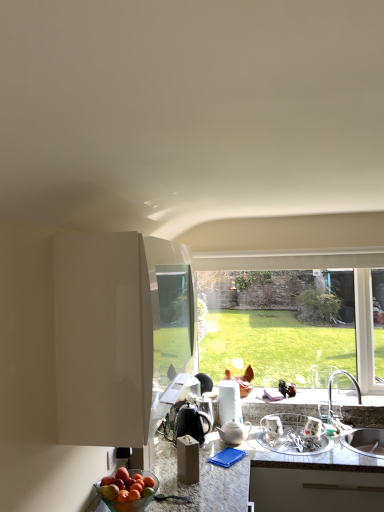
Question: Considering the relative positions of granite countertop at center and metallic silver dish rack at lower right, marked as the third appliance in a left-to-right arrangement, in the image provided, is granite countertop at center behind metallic silver dish rack at lower right, marked as the third appliance in a left-to-right arrangement,?

Choices:
 (A) yes
 (B) no

Answer: (B)

Question: Is granite countertop at center far away from metallic silver dish rack at lower right, marked as the third appliance in a left-to-right arrangement?

Choices:
 (A) yes
 (B) no

Answer: (B)

Question: Is the surface of granite countertop at center in direct contact with metallic silver dish rack at lower right, marked as the third appliance in a left-to-right arrangement?

Choices:
 (A) no
 (B) yes

Answer: (A)

Question: Considering the relative sizes of granite countertop at center and metallic silver dish rack at lower right, the 1th appliance viewed from the right, in the image provided, is granite countertop at center bigger than metallic silver dish rack at lower right, the 1th appliance viewed from the right,?

Choices:
 (A) no
 (B) yes

Answer: (B)

Question: Is granite countertop at center to the left of metallic silver dish rack at lower right, marked as the third appliance in a left-to-right arrangement, from the viewer's perspective?

Choices:
 (A) yes
 (B) no

Answer: (A)

Question: From the image's perspective, is shiny metallic kettle at center, marked as the 3th appliance in a right-to-left arrangement, positioned above or below white glossy cabinet at left?

Choices:
 (A) above
 (B) below

Answer: (B)

Question: Which is correct: shiny metallic kettle at center, acting as the first appliance starting from the left, is inside white glossy cabinet at left, or outside of it?

Choices:
 (A) outside
 (B) inside

Answer: (A)

Question: Is shiny metallic kettle at center, marked as the 3th appliance in a right-to-left arrangement, wider or thinner than white glossy cabinet at left?

Choices:
 (A) wide
 (B) thin

Answer: (B)

Question: Considering their positions, is shiny metallic kettle at center, acting as the first appliance starting from the left, located in front of or behind white glossy cabinet at left?

Choices:
 (A) behind
 (B) front

Answer: (A)

Question: From a real-world perspective, is metallic silver kettle at center, the second appliance from the right, positioned above or below granite countertop at center?

Choices:
 (A) above
 (B) below

Answer: (A)

Question: Based on their sizes in the image, would you say metallic silver kettle at center, acting as the 2th appliance starting from the left, is bigger or smaller than granite countertop at center?

Choices:
 (A) big
 (B) small

Answer: (B)

Question: In terms of height, does metallic silver kettle at center, the second appliance from the right, look taller or shorter compared to granite countertop at center?

Choices:
 (A) short
 (B) tall

Answer: (A)

Question: Visually, is metallic silver kettle at center, the second appliance from the right, positioned to the left or to the right of granite countertop at center?

Choices:
 (A) left
 (B) right

Answer: (A)

Question: Based on their sizes in the image, would you say white glossy cabinet at left is bigger or smaller than metallic silver dish rack at lower right, the 1th appliance viewed from the right?

Choices:
 (A) big
 (B) small

Answer: (A)

Question: Which is correct: white glossy cabinet at left is inside metallic silver dish rack at lower right, the 1th appliance viewed from the right, or outside of it?

Choices:
 (A) outside
 (B) inside

Answer: (A)